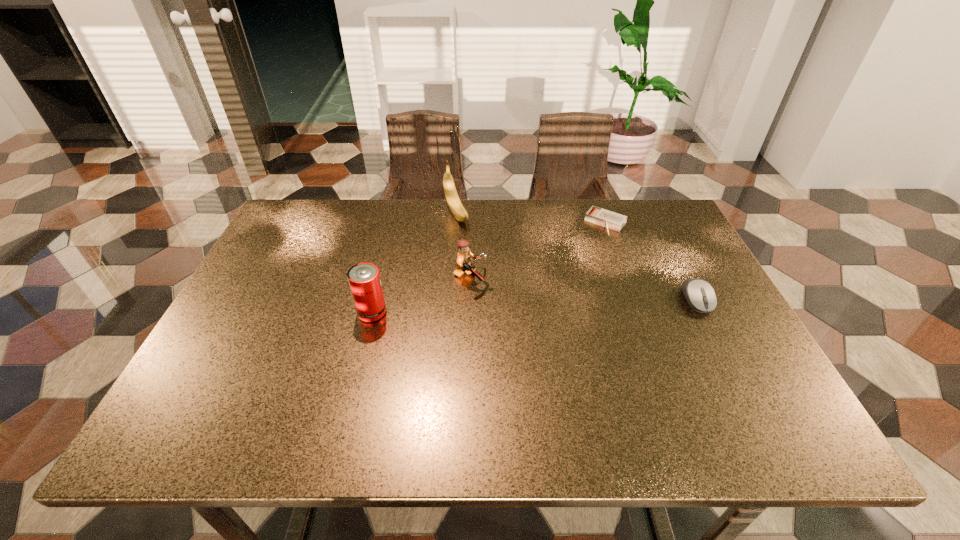
The image size is (960, 540). In order to click on vacant space at the near right corner in this screenshot , I will do `click(696, 372)`.

Find the location of `vacant space that is in between the can and the Lego`. vacant space that is in between the can and the Lego is located at coordinates (420, 295).

Locate an element on the screen. The height and width of the screenshot is (540, 960). vacant space that's between the second object from right to left and the tallest object is located at coordinates click(x=531, y=219).

This screenshot has width=960, height=540. I want to click on empty location between the computer equipment and the second object from right to left, so click(651, 261).

The width and height of the screenshot is (960, 540). Identify the location of free point between the matchbox and the leftmost object. (489, 268).

This screenshot has width=960, height=540. Identify the location of free space that is in between the Lego and the matchbox. (538, 251).

Find the location of a particular element. The width and height of the screenshot is (960, 540). vacant area between the fourth tallest object and the leftmost object is located at coordinates (534, 306).

Locate an element on the screen. Image resolution: width=960 pixels, height=540 pixels. free space between the can and the Lego is located at coordinates (420, 295).

Find the location of `free space between the can and the Lego`. free space between the can and the Lego is located at coordinates (420, 295).

Find the location of a particular element. This screenshot has height=540, width=960. object that is the third nearest to the fourth tallest object is located at coordinates click(x=456, y=207).